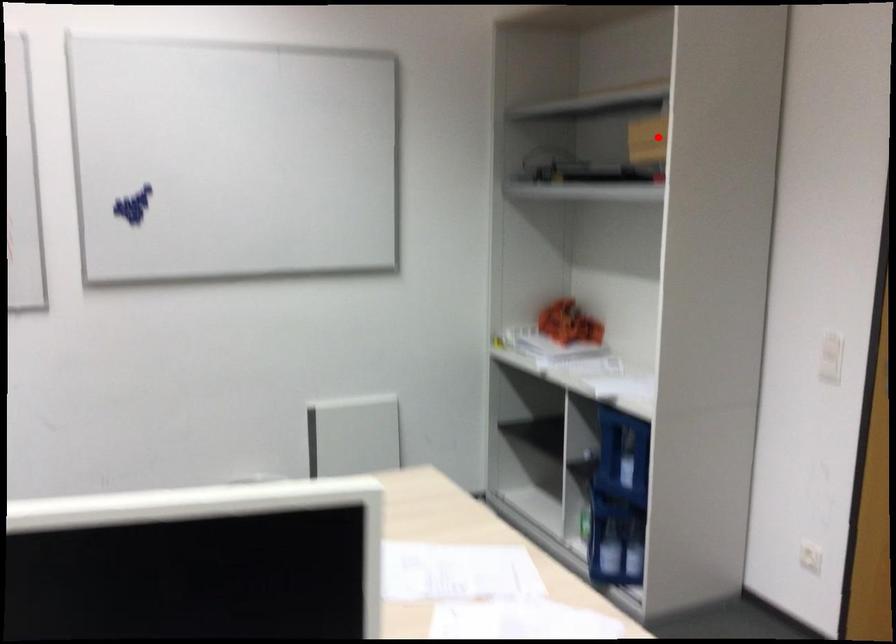
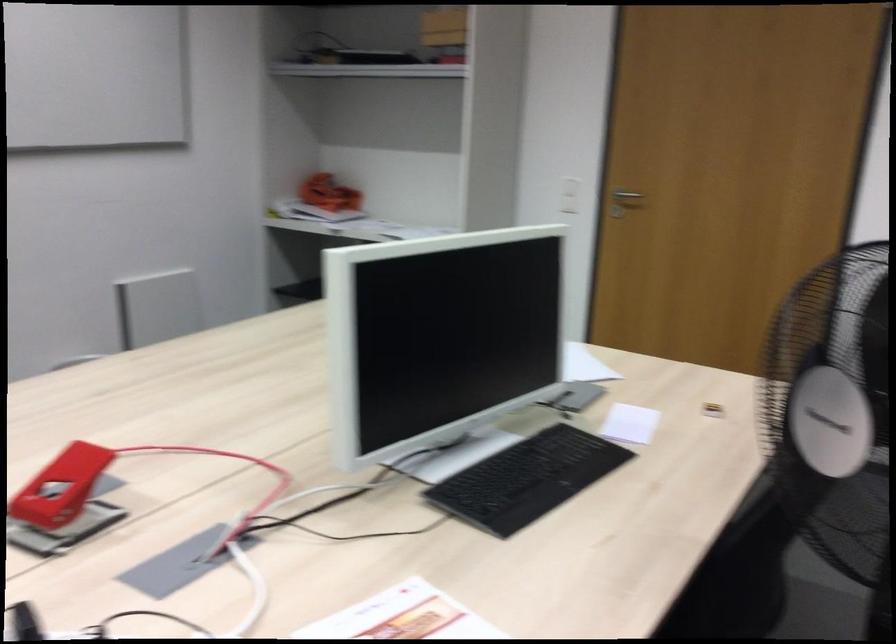
Where in the second image is the point corresponding to the highlighted location from the first image?

(444, 26)